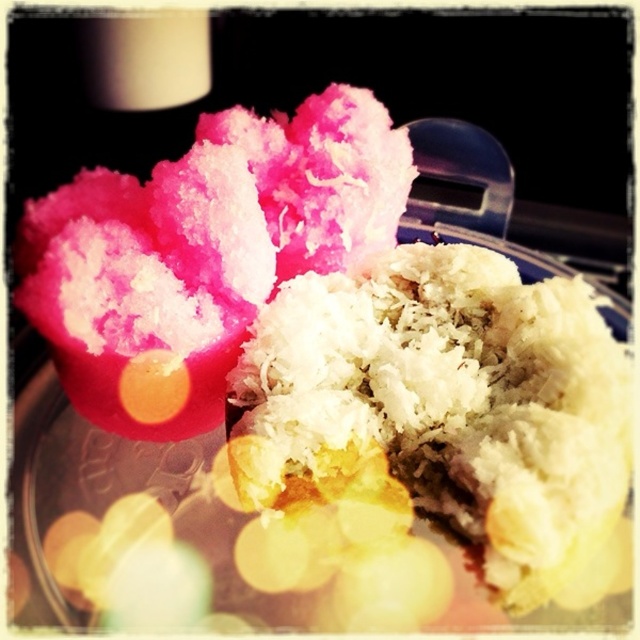
Question: Which object appears closest to the camera in this image?

Choices:
 (A) white shredded rice at center
 (B) pink fluffy cotton candy at upper left

Answer: (A)

Question: Which of the following is the farthest from the observer?

Choices:
 (A) (160, 417)
 (B) (609, 390)

Answer: (A)

Question: Is white shredded rice at center closer to the viewer compared to pink fluffy cotton candy at upper left?

Choices:
 (A) yes
 (B) no

Answer: (A)

Question: Is white shredded rice at center below pink fluffy cotton candy at upper left?

Choices:
 (A) yes
 (B) no

Answer: (A)

Question: Can you confirm if white shredded rice at center is bigger than pink fluffy cotton candy at upper left?

Choices:
 (A) no
 (B) yes

Answer: (A)

Question: Which point is closer to the camera?

Choices:
 (A) pink fluffy cotton candy at upper left
 (B) white shredded rice at center

Answer: (B)